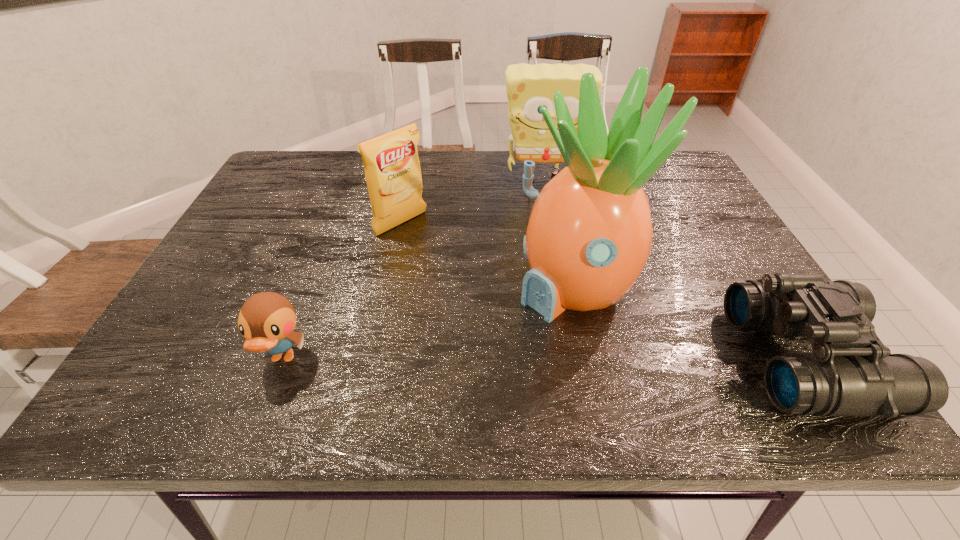
Where is `binoculars at the near edge`? binoculars at the near edge is located at coordinates (850, 373).

At what (x,y) coordinates should I click in order to perform the action: click on pineapple at the near edge. Please return your answer as a coordinate pair (x, y). Looking at the image, I should click on (589, 236).

Where is `object present at the right edge`? This screenshot has width=960, height=540. object present at the right edge is located at coordinates (850, 373).

You are a GUI agent. You are given a task and a screenshot of the screen. Output one action in this format:
    pyautogui.click(x=<x>, y=<y>)
    Task: Click on the object located at the near right corner
    Image resolution: width=960 pixels, height=540 pixels.
    Given the screenshot: What is the action you would take?
    pyautogui.click(x=850, y=373)

At what (x,y) coordinates should I click in order to perform the action: click on vacant space at the far edge. Please return your answer as a coordinate pair (x, y). Looking at the image, I should click on (544, 172).

This screenshot has width=960, height=540. I want to click on free space at the near edge of the desktop, so click(240, 352).

This screenshot has width=960, height=540. In order to click on free location at the left edge in this screenshot , I will do `click(262, 208)`.

The image size is (960, 540). Identify the location of vacant area at the far left corner. (309, 161).

Find the location of a particular element. vacant region at the near right corner of the desktop is located at coordinates (764, 351).

In order to click on unoccupied position between the crisp (potato chip) and the duck in this screenshot , I will do `click(342, 291)`.